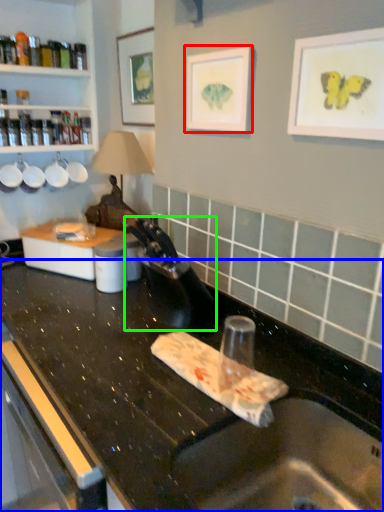
Question: Which object is the closest to the picture frame (highlighted by a red box)? Choose among these: countertop (highlighted by a blue box) or faucet (highlighted by a green box).

Choices:
 (A) countertop
 (B) faucet

Answer: (B)